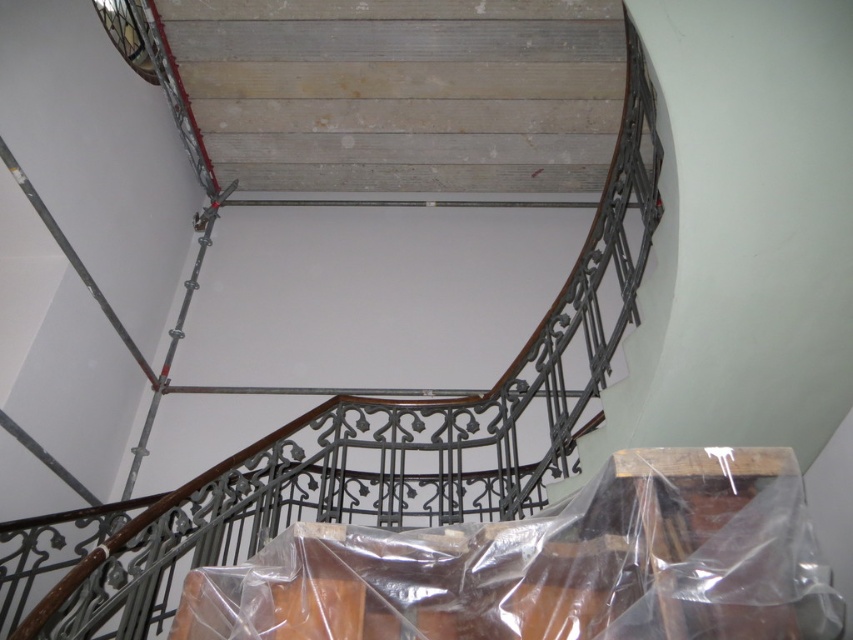
Question: From the image, what is the correct spatial relationship of wooden stairs at upper center in relation to transparent plastic bag at center?

Choices:
 (A) right
 (B) left

Answer: (B)

Question: Can you confirm if wooden stairs at upper center is positioned to the right of transparent plastic bag at center?

Choices:
 (A) yes
 (B) no

Answer: (B)

Question: Does wooden stairs at upper center lie behind transparent plastic bag at center?

Choices:
 (A) no
 (B) yes

Answer: (B)

Question: Which point is closer to the camera?

Choices:
 (A) wooden stairs at upper center
 (B) transparent plastic bag at center

Answer: (B)